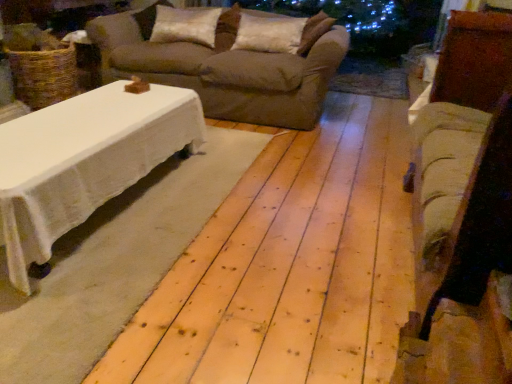
Question: Is beige fabric couch at center positioned with its back to velvet beige armchair at right?

Choices:
 (A) no
 (B) yes

Answer: (A)

Question: From the image's perspective, does beige fabric couch at center appear lower than velvet beige armchair at right?

Choices:
 (A) no
 (B) yes

Answer: (A)

Question: From the image's perspective, is beige fabric couch at center on velvet beige armchair at right?

Choices:
 (A) yes
 (B) no

Answer: (A)

Question: Is beige fabric couch at center outside of velvet beige armchair at right?

Choices:
 (A) no
 (B) yes

Answer: (B)

Question: Is beige fabric couch at center beside velvet beige armchair at right?

Choices:
 (A) yes
 (B) no

Answer: (B)

Question: From a real-world perspective, relative to velvet beige armchair at right, is beige fabric couch at center vertically above or below?

Choices:
 (A) below
 (B) above

Answer: (A)

Question: In terms of height, does beige fabric couch at center look taller or shorter compared to velvet beige armchair at right?

Choices:
 (A) tall
 (B) short

Answer: (B)

Question: From the image's perspective, is beige fabric couch at center positioned above or below velvet beige armchair at right?

Choices:
 (A) above
 (B) below

Answer: (A)

Question: Does point (312, 46) appear closer or farther from the camera than point (507, 206)?

Choices:
 (A) farther
 (B) closer

Answer: (A)

Question: In the image, is velvet beige armchair at right on the left side or the right side of white soft pillow at upper center, the second pillow when ordered from right to left?

Choices:
 (A) left
 (B) right

Answer: (B)

Question: Is point (476, 281) closer or farther from the camera than point (170, 29)?

Choices:
 (A) closer
 (B) farther

Answer: (A)

Question: From a real-world perspective, is velvet beige armchair at right physically located above or below white soft pillow at upper center, the second pillow when ordered from right to left?

Choices:
 (A) above
 (B) below

Answer: (B)

Question: Looking at their shapes, would you say velvet beige armchair at right is wider or thinner than white soft pillow at upper center, the second pillow when ordered from right to left?

Choices:
 (A) thin
 (B) wide

Answer: (B)

Question: From a real-world perspective, is satin white pillow at center, which ranks as the 1th pillow in right-to-left order, above or below white soft pillow at upper center, the second pillow when ordered from right to left?

Choices:
 (A) above
 (B) below

Answer: (B)

Question: In terms of size, does satin white pillow at center, which ranks as the 2th pillow in left-to-right order, appear bigger or smaller than white soft pillow at upper center, the second pillow when ordered from right to left?

Choices:
 (A) small
 (B) big

Answer: (A)